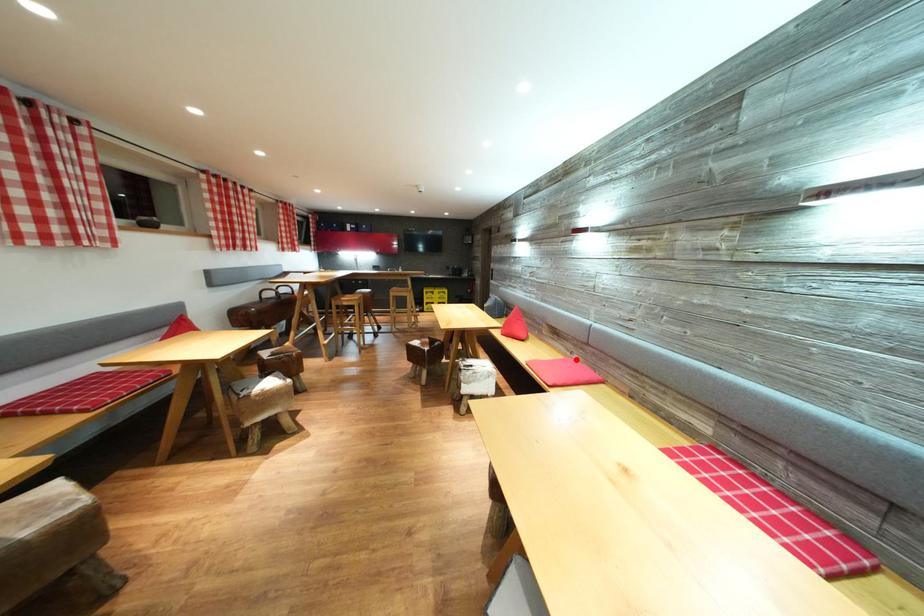
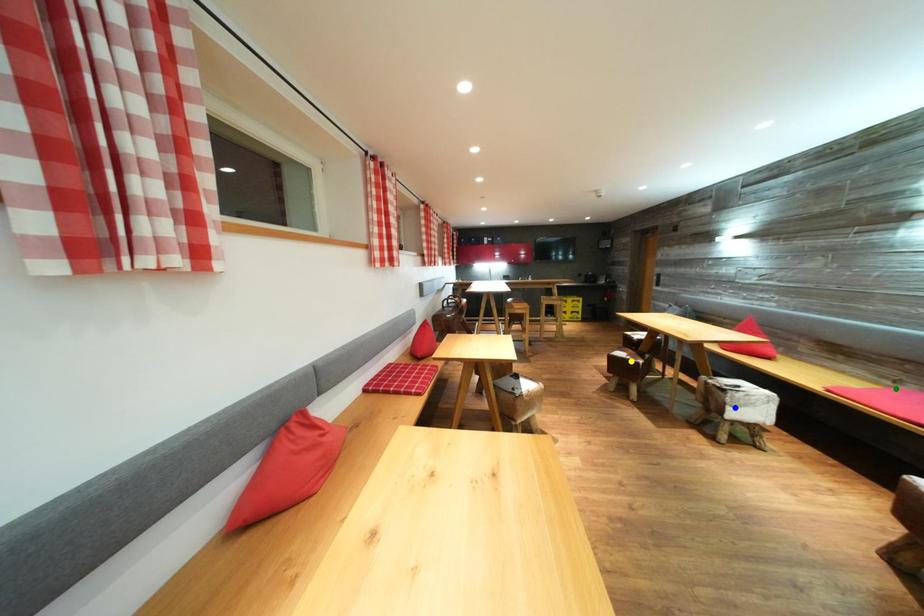
Question: I am providing you with two images of the same scene from different viewpoints. A red point is marked on the first image. You are given multiple points on the second image. Which point in image 2 is actually the same real-world point as the red point in image 1?

Choices:
 (A) yellow point
 (B) blue point
 (C) green point

Answer: (C)